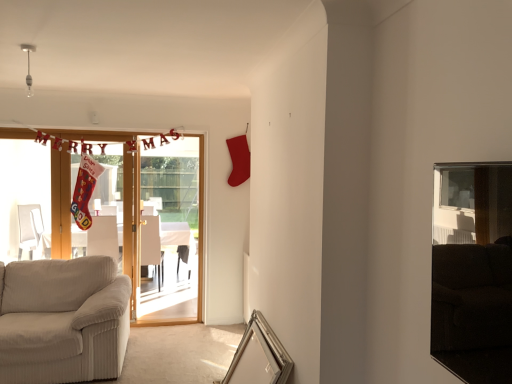
Question: From the image's perspective, does wooden door at left appear lower than metallic silver picture frame at lower center?

Choices:
 (A) yes
 (B) no

Answer: (B)

Question: Does wooden door at left have a lesser width compared to metallic silver picture frame at lower center?

Choices:
 (A) yes
 (B) no

Answer: (A)

Question: Is wooden door at left wider than metallic silver picture frame at lower center?

Choices:
 (A) yes
 (B) no

Answer: (B)

Question: Is wooden door at left shorter than metallic silver picture frame at lower center?

Choices:
 (A) no
 (B) yes

Answer: (A)

Question: Does wooden door at left turn towards metallic silver picture frame at lower center?

Choices:
 (A) no
 (B) yes

Answer: (B)

Question: From a real-world perspective, relative to metallic silver picture frame at lower center, is beige fabric couch at lower left vertically above or below?

Choices:
 (A) below
 (B) above

Answer: (B)

Question: Is beige fabric couch at lower left spatially inside metallic silver picture frame at lower center, or outside of it?

Choices:
 (A) outside
 (B) inside

Answer: (A)

Question: Does point (118, 278) appear closer or farther from the camera than point (256, 372)?

Choices:
 (A) closer
 (B) farther

Answer: (B)

Question: Considering their positions, is beige fabric couch at lower left located in front of or behind metallic silver picture frame at lower center?

Choices:
 (A) front
 (B) behind

Answer: (B)

Question: From the image's perspective, is beige fabric couch at lower left positioned above or below white fabric armchair at left, the 1th armchair when ordered from left to right?

Choices:
 (A) below
 (B) above

Answer: (A)

Question: Is beige fabric couch at lower left wider or thinner than white fabric armchair at left, marked as the 2th armchair in a right-to-left arrangement?

Choices:
 (A) thin
 (B) wide

Answer: (B)

Question: Which is correct: beige fabric couch at lower left is inside white fabric armchair at left, the 1th armchair when ordered from left to right, or outside of it?

Choices:
 (A) inside
 (B) outside

Answer: (B)

Question: Is point click(x=31, y=321) positioned closer to the camera than point click(x=98, y=246)?

Choices:
 (A) closer
 (B) farther

Answer: (A)

Question: In terms of size, does metallic silver picture frame at lower center appear bigger or smaller than wooden door at left?

Choices:
 (A) small
 (B) big

Answer: (A)

Question: Looking at their shapes, would you say metallic silver picture frame at lower center is wider or thinner than wooden door at left?

Choices:
 (A) wide
 (B) thin

Answer: (A)